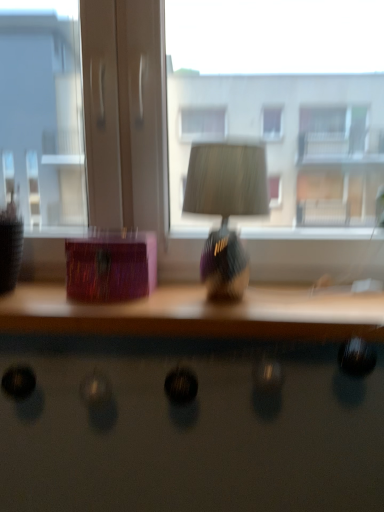
Question: Is shiny purple lampshade at center shorter than shiny black desk at lower center?

Choices:
 (A) yes
 (B) no

Answer: (B)

Question: Could you tell me if shiny purple lampshade at center is turned towards shiny black desk at lower center?

Choices:
 (A) yes
 (B) no

Answer: (B)

Question: Can you see shiny purple lampshade at center touching shiny black desk at lower center?

Choices:
 (A) no
 (B) yes

Answer: (A)

Question: Is shiny purple lampshade at center positioned before shiny black desk at lower center?

Choices:
 (A) no
 (B) yes

Answer: (A)

Question: From the image's perspective, is shiny purple lampshade at center on shiny black desk at lower center?

Choices:
 (A) no
 (B) yes

Answer: (B)

Question: Would you say transparent glass window at center is to the left or to the right of shiny black desk at lower center in the picture?

Choices:
 (A) left
 (B) right

Answer: (A)

Question: Considering the positions of transparent glass window at center and shiny black desk at lower center in the image, is transparent glass window at center wider or thinner than shiny black desk at lower center?

Choices:
 (A) wide
 (B) thin

Answer: (A)

Question: Which is correct: transparent glass window at center is inside shiny black desk at lower center, or outside of it?

Choices:
 (A) inside
 (B) outside

Answer: (B)

Question: From a real-world perspective, is transparent glass window at center physically located above or below shiny black desk at lower center?

Choices:
 (A) above
 (B) below

Answer: (A)

Question: From a real-world perspective, is shiny purple lampshade at center positioned above or below transparent glass window at center?

Choices:
 (A) above
 (B) below

Answer: (B)

Question: Based on their sizes in the image, would you say shiny purple lampshade at center is bigger or smaller than transparent glass window at center?

Choices:
 (A) small
 (B) big

Answer: (A)

Question: From the image's perspective, is shiny purple lampshade at center above or below transparent glass window at center?

Choices:
 (A) above
 (B) below

Answer: (B)

Question: Relative to transparent glass window at center, is shiny purple lampshade at center in front or behind?

Choices:
 (A) behind
 (B) front

Answer: (B)

Question: From the image's perspective, is shiny black desk at lower center located above or below wooden table at center?

Choices:
 (A) above
 (B) below

Answer: (B)

Question: Visually, is shiny black desk at lower center positioned to the left or to the right of wooden table at center?

Choices:
 (A) left
 (B) right

Answer: (B)